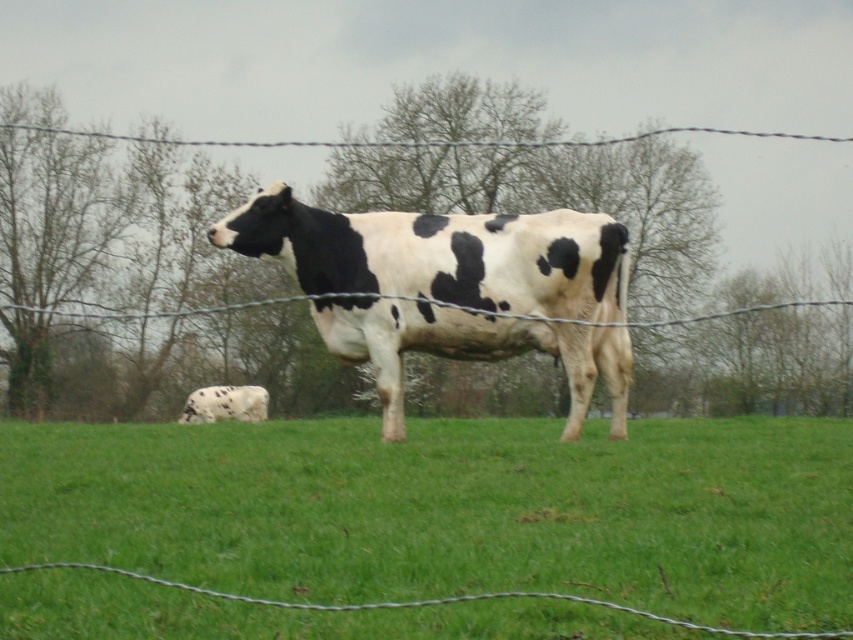
Based on the photo, you are a farmer checking the fence. You see the black and white spotted cow at center and the wire at center. Which object is closer to the ground?

The black and white spotted cow at center is closer to the ground because it is below the wire at center.

You are a drone operator trying to capture a closeup of the cow in the rural scene. You notice two points marked on your screen at coordinates point (822, 589) and point (54, 312). According to the scene description, which point is closer to the cow?

Point (822, 589) is in front of point (54, 312), so the point closer to the cow is point (822, 589).